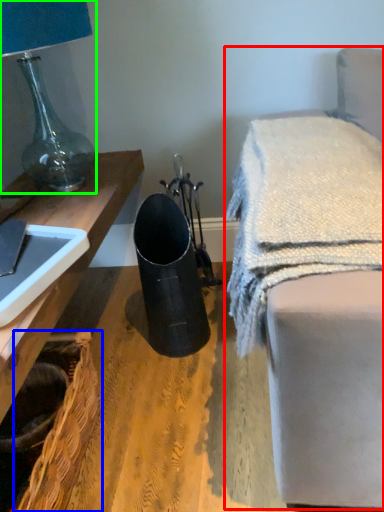
Question: Based on their relative distances, which object is nearer to furniture (highlighted by a red box)? Choose from basket (highlighted by a blue box) and lamp (highlighted by a green box).

Choices:
 (A) basket
 (B) lamp

Answer: (A)